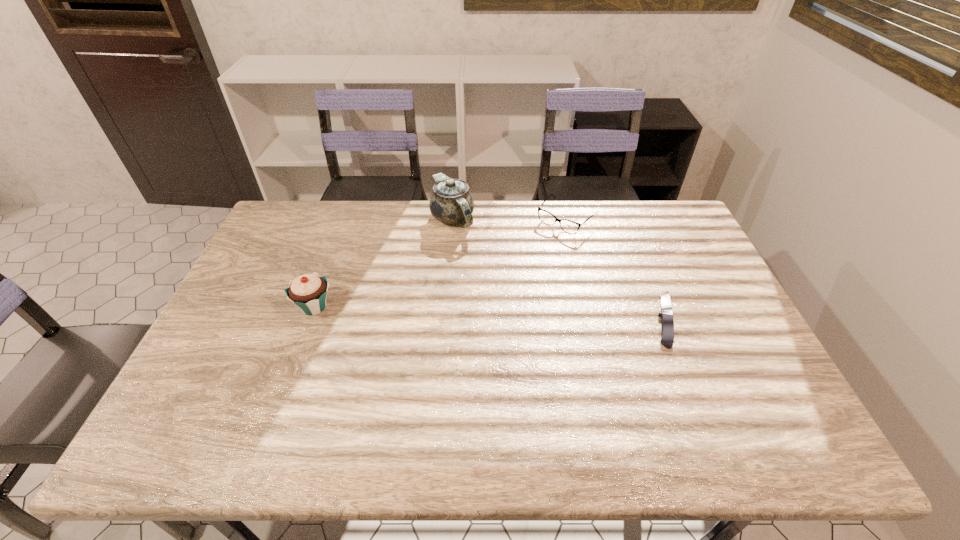
Find the location of `free space on the desktop that is between the cupcake and the shortest object and is positioned from the spout of the tallest object`. free space on the desktop that is between the cupcake and the shortest object and is positioned from the spout of the tallest object is located at coordinates (474, 313).

You are a GUI agent. You are given a task and a screenshot of the screen. Output one action in this format:
    pyautogui.click(x=<x>, y=<y>)
    Task: Click on the free space on the desktop that is between the leftmost object and the steak knife and is positioned on the front-facing side of the spectacles
    
    Given the screenshot: What is the action you would take?
    pyautogui.click(x=475, y=313)